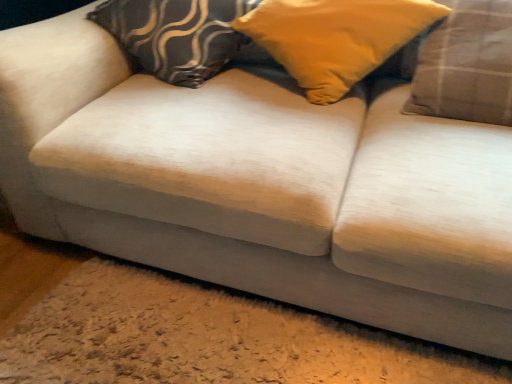
Question: From a real-world perspective, is plaid fabric pillow at right, which is the first pillow from right to left, on top of yellow fabric pillow at center, marked as the 2th pillow in a right-to-left arrangement?

Choices:
 (A) no
 (B) yes

Answer: (A)

Question: Does plaid fabric pillow at right, which is the first pillow from right to left, have a smaller size compared to yellow fabric pillow at center, marked as the 2th pillow in a right-to-left arrangement?

Choices:
 (A) no
 (B) yes

Answer: (B)

Question: Can you confirm if plaid fabric pillow at right, which is the first pillow from right to left, is thinner than yellow fabric pillow at center, the 2th pillow viewed from the left?

Choices:
 (A) no
 (B) yes

Answer: (B)

Question: Considering the relative sizes of plaid fabric pillow at right, which is the first pillow from right to left, and yellow fabric pillow at center, marked as the 2th pillow in a right-to-left arrangement, in the image provided, is plaid fabric pillow at right, which is the first pillow from right to left, shorter than yellow fabric pillow at center, marked as the 2th pillow in a right-to-left arrangement,?

Choices:
 (A) yes
 (B) no

Answer: (B)

Question: From a real-world perspective, is plaid fabric pillow at right, which is the third pillow from left to right, positioned under yellow fabric pillow at center, the 2th pillow viewed from the left, based on gravity?

Choices:
 (A) no
 (B) yes

Answer: (B)

Question: Is plaid fabric pillow at right, which is the first pillow from right to left, positioned in front of yellow fabric pillow at center, marked as the 2th pillow in a right-to-left arrangement?

Choices:
 (A) yes
 (B) no

Answer: (A)

Question: Would you say yellow fabric pillow at center, the 2th pillow viewed from the left, is part of velvet-patterned pillow at center, the third pillow in the right-to-left sequence,'s contents?

Choices:
 (A) yes
 (B) no

Answer: (B)

Question: Is velvet-patterned pillow at center, which ranks as the first pillow in left-to-right order, smaller than yellow fabric pillow at center, marked as the 2th pillow in a right-to-left arrangement?

Choices:
 (A) yes
 (B) no

Answer: (B)

Question: From a real-world perspective, is velvet-patterned pillow at center, which ranks as the first pillow in left-to-right order, located beneath yellow fabric pillow at center, the 2th pillow viewed from the left?

Choices:
 (A) yes
 (B) no

Answer: (A)

Question: Can you confirm if velvet-patterned pillow at center, which ranks as the first pillow in left-to-right order, is bigger than yellow fabric pillow at center, marked as the 2th pillow in a right-to-left arrangement?

Choices:
 (A) no
 (B) yes

Answer: (B)

Question: From the image's perspective, is velvet-patterned pillow at center, the third pillow in the right-to-left sequence, beneath yellow fabric pillow at center, the 2th pillow viewed from the left?

Choices:
 (A) yes
 (B) no

Answer: (B)

Question: Is velvet-patterned pillow at center, which ranks as the first pillow in left-to-right order, at the left side of yellow fabric pillow at center, the 2th pillow viewed from the left?

Choices:
 (A) yes
 (B) no

Answer: (A)

Question: From the image's perspective, is plaid fabric pillow at right, which is the third pillow from left to right, on velvet-patterned pillow at center, which ranks as the first pillow in left-to-right order?

Choices:
 (A) no
 (B) yes

Answer: (A)